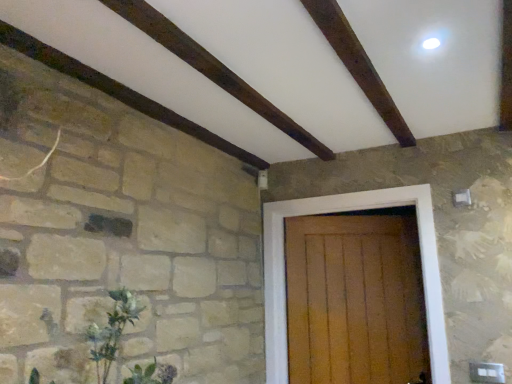
Question: Could you tell me if wooden door at center is facing green leafy plant at lower left?

Choices:
 (A) no
 (B) yes

Answer: (B)

Question: Can you confirm if wooden door at center is positioned to the right of green leafy plant at lower left?

Choices:
 (A) no
 (B) yes

Answer: (B)

Question: Does wooden door at center come in front of green leafy plant at lower left?

Choices:
 (A) no
 (B) yes

Answer: (A)

Question: Is wooden door at center taller than green leafy plant at lower left?

Choices:
 (A) yes
 (B) no

Answer: (A)

Question: From a real-world perspective, is wooden door at center under green leafy plant at lower left?

Choices:
 (A) no
 (B) yes

Answer: (A)

Question: From a real-world perspective, is wooden door at center located higher than green leafy plant at lower left?

Choices:
 (A) yes
 (B) no

Answer: (A)

Question: From a real-world perspective, does green leafy plant at lower left sit lower than wooden door at center?

Choices:
 (A) no
 (B) yes

Answer: (B)

Question: Would you consider green leafy plant at lower left to be distant from wooden door at center?

Choices:
 (A) no
 (B) yes

Answer: (B)

Question: Is wooden door at center a part of green leafy plant at lower left?

Choices:
 (A) yes
 (B) no

Answer: (B)

Question: Is green leafy plant at lower left closer to camera compared to wooden door at center?

Choices:
 (A) no
 (B) yes

Answer: (B)

Question: Does green leafy plant at lower left have a greater width compared to wooden door at center?

Choices:
 (A) yes
 (B) no

Answer: (A)

Question: Is green leafy plant at lower left oriented away from wooden door at center?

Choices:
 (A) yes
 (B) no

Answer: (B)

Question: Is wooden door at center wider or thinner than green leafy plant at lower left?

Choices:
 (A) wide
 (B) thin

Answer: (B)